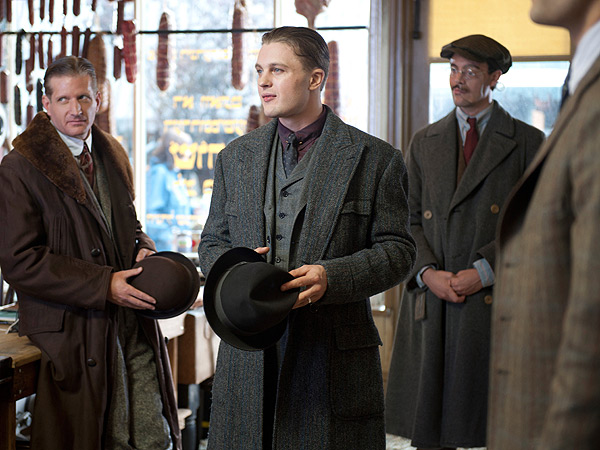
Identify the location of table. Image resolution: width=600 pixels, height=450 pixels. (22, 345).